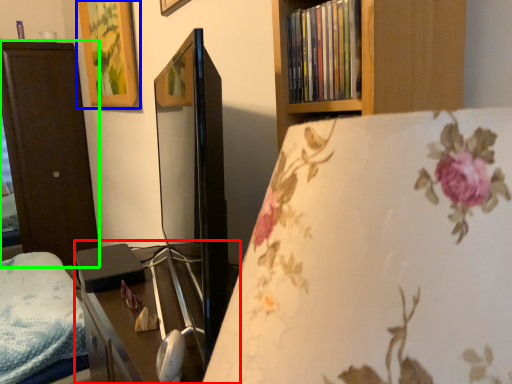
Question: Based on their relative distances, which object is farther from table (highlighted by a red box)? Choose from picture frame (highlighted by a blue box) and furniture (highlighted by a green box).

Choices:
 (A) picture frame
 (B) furniture

Answer: (B)